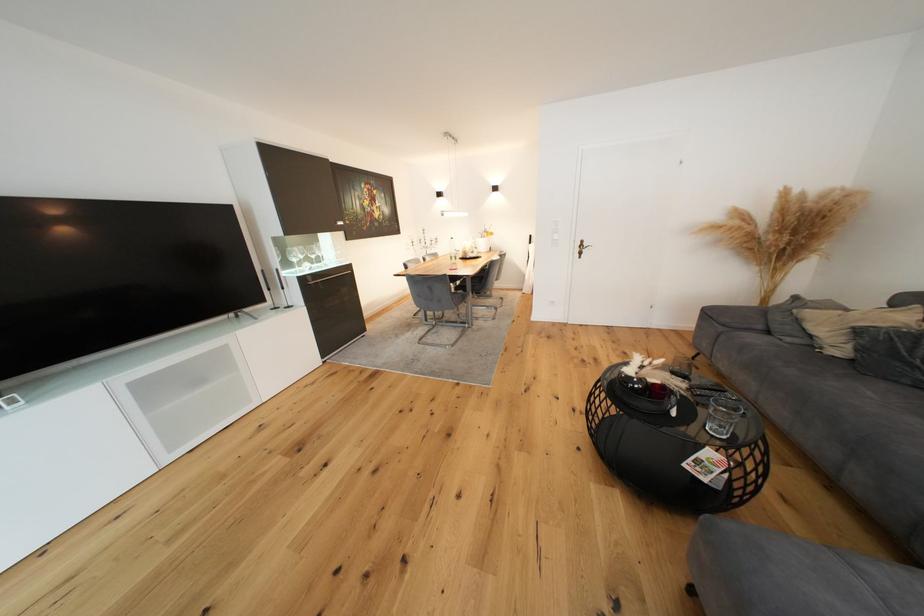
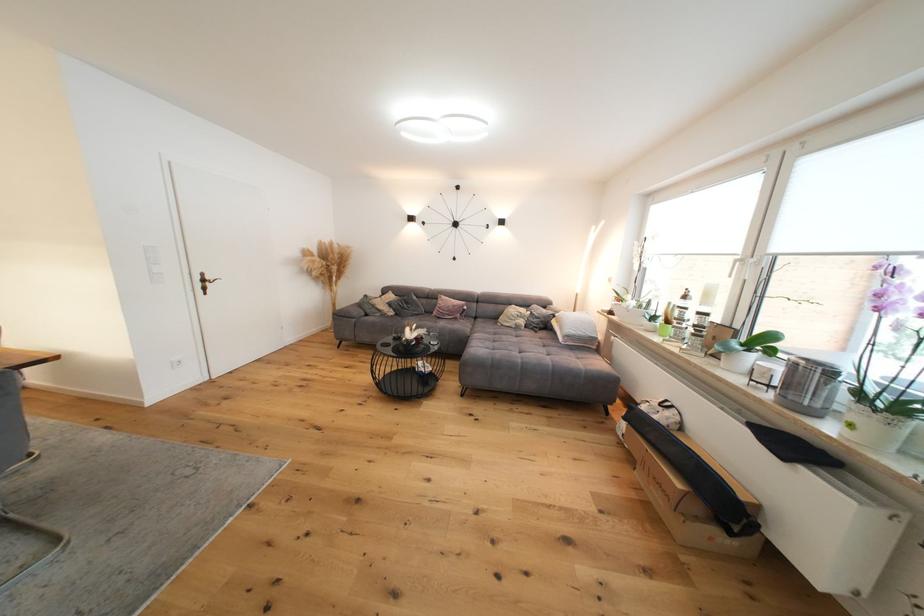
The point at (589, 248) is marked in the first image. Where is the corresponding point in the second image?

(211, 282)